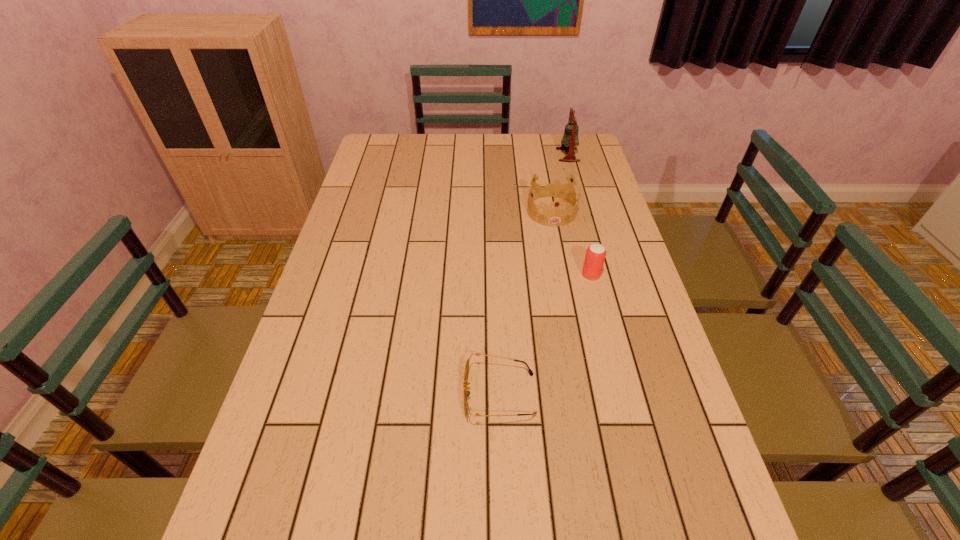
The image size is (960, 540). Identify the location of free spot at the far left corner of the desktop. (405, 164).

Find the location of a particular element. free space between the farthest object and the shortest object is located at coordinates (534, 275).

Locate an element on the screen. This screenshot has width=960, height=540. vacant region between the tallest object and the third nearest object is located at coordinates tap(560, 183).

Identify the location of vacant space that's between the farthest object and the leftmost object. The width and height of the screenshot is (960, 540). (534, 275).

Where is `free spot between the beer can and the third nearest object`? This screenshot has width=960, height=540. free spot between the beer can and the third nearest object is located at coordinates (571, 243).

The height and width of the screenshot is (540, 960). I want to click on blank region between the tiara and the beer can, so click(571, 243).

Point out which object is positioned as the second nearest to the second farthest object. Please provide its 2D coordinates. Your answer should be formatted as a tuple, i.e. [(x, y)], where the tuple contains the x and y coordinates of a point satisfying the conditions above.

[(570, 138)]

Locate which object is the third closest to the bell. Please provide its 2D coordinates. Your answer should be formatted as a tuple, i.e. [(x, y)], where the tuple contains the x and y coordinates of a point satisfying the conditions above.

[(466, 393)]

Find the location of a particular element. vacant region that satisfies the following two spatial constraints: 1. on the front-facing side of the second farthest object; 2. on the right side of the beer can is located at coordinates (564, 275).

Where is `vacant area that satisfies the following two spatial constraints: 1. on the front side of the beer can; 2. on the lenses of the leftmost object`? vacant area that satisfies the following two spatial constraints: 1. on the front side of the beer can; 2. on the lenses of the leftmost object is located at coordinates (621, 394).